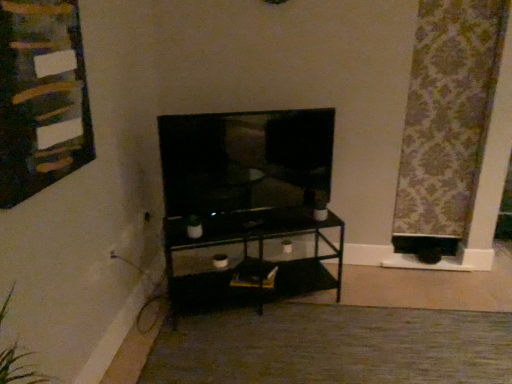
Question: Relative to matte black tv at center, is wooden bulletin board at upper left in front or behind?

Choices:
 (A) front
 (B) behind

Answer: (A)

Question: From the image's perspective, is wooden bulletin board at upper left positioned above or below matte black tv at center?

Choices:
 (A) below
 (B) above

Answer: (B)

Question: Which object is positioned closest to the matte black tv at center?

Choices:
 (A) patterned fabric curtain at right
 (B) black glass shelf at center
 (C) wooden bulletin board at upper left
 (D) carpet at center

Answer: (B)

Question: Which object is positioned farthest from the carpet at center?

Choices:
 (A) black glass shelf at center
 (B) patterned fabric curtain at right
 (C) wooden bulletin board at upper left
 (D) matte black tv at center

Answer: (C)